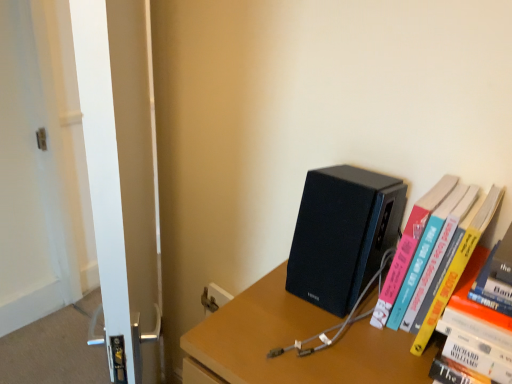
Where is `free point above matte black speaker at upper right (from a real-world perspective)`? This screenshot has height=384, width=512. free point above matte black speaker at upper right (from a real-world perspective) is located at coordinates [320, 334].